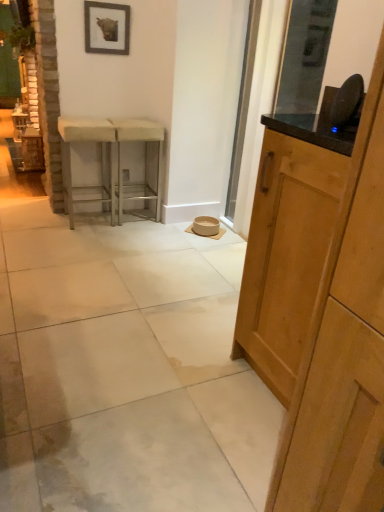
Question: Would you say white polished concrete at center is to the left or to the right of metallic silver stool at center, marked as the 2th stool in a left-to-right arrangement, in the picture?

Choices:
 (A) right
 (B) left

Answer: (B)

Question: Does point (196, 458) appear closer or farther from the camera than point (157, 219)?

Choices:
 (A) closer
 (B) farther

Answer: (A)

Question: Estimate the real-world distances between objects in this image. Which object is closer to the transparent glass screen door at center?

Choices:
 (A) metallic silver stool at center, marked as the 2th stool in a left-to-right arrangement
 (B) wooden frame at upper center
 (C) white fabric stool at left, which is counted as the 2th stool, starting from the right
 (D) white polished concrete at center
 (E) light wood cabinet at right

Answer: (A)

Question: Which object is positioned farthest from the white fabric stool at left, which is counted as the 2th stool, starting from the right?

Choices:
 (A) wooden frame at upper center
 (B) white polished concrete at center
 (C) metallic silver stool at center, marked as the 1th stool in a right-to-left arrangement
 (D) transparent glass screen door at center
 (E) light wood cabinet at right

Answer: (E)